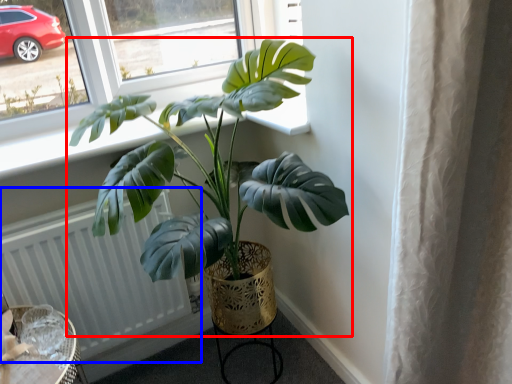
Question: Which object appears closest to the camera in this image, houseplant (highlighted by a red box) or radiator (highlighted by a blue box)?

Choices:
 (A) houseplant
 (B) radiator

Answer: (A)